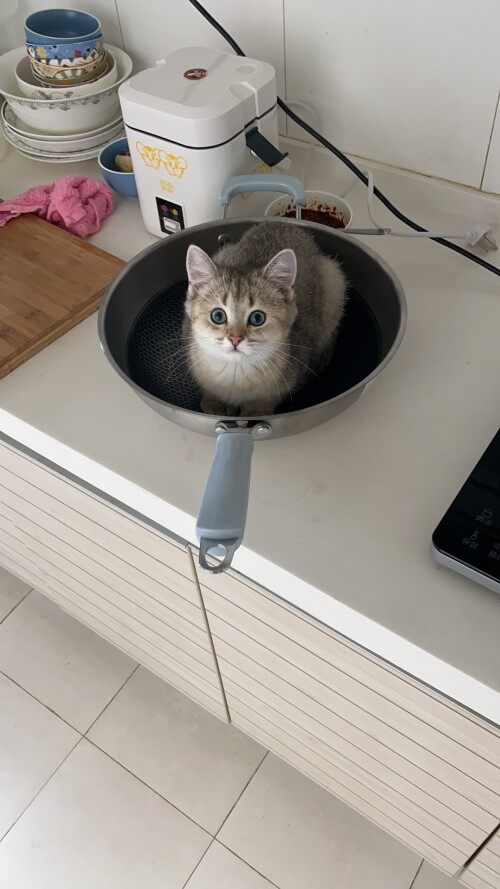
The height and width of the screenshot is (889, 500). What are the coordinates of `power cords` in the screenshot? It's located at (454, 238), (427, 227), (395, 231).